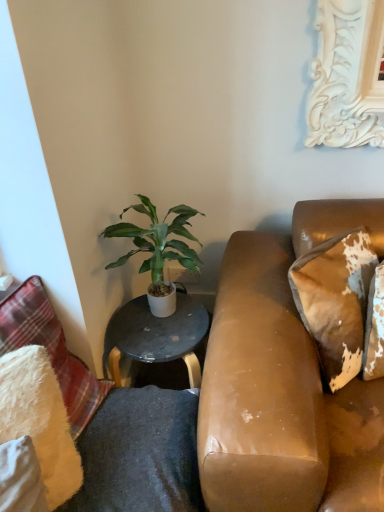
Question: Is green leafy plant at center far from white fluffy pillow at lower left, placed as the 2th pillow when sorted from left to right?

Choices:
 (A) no
 (B) yes

Answer: (A)

Question: Can you confirm if green leafy plant at center is wider than white fluffy pillow at lower left, placed as the 2th pillow when sorted from right to left?

Choices:
 (A) no
 (B) yes

Answer: (B)

Question: Could you tell me if green leafy plant at center is turned towards white fluffy pillow at lower left, placed as the 2th pillow when sorted from right to left?

Choices:
 (A) yes
 (B) no

Answer: (B)

Question: Can you confirm if green leafy plant at center is smaller than white fluffy pillow at lower left, placed as the 2th pillow when sorted from right to left?

Choices:
 (A) yes
 (B) no

Answer: (B)

Question: Is green leafy plant at center taller than white fluffy pillow at lower left, placed as the 2th pillow when sorted from right to left?

Choices:
 (A) yes
 (B) no

Answer: (A)

Question: Is white glossy table at center spatially inside green leafy plant at center, or outside of it?

Choices:
 (A) outside
 (B) inside

Answer: (A)

Question: Is white glossy table at center taller or shorter than green leafy plant at center?

Choices:
 (A) tall
 (B) short

Answer: (A)

Question: From a real-world perspective, relative to green leafy plant at center, is white glossy table at center vertically above or below?

Choices:
 (A) above
 (B) below

Answer: (B)

Question: In terms of width, does white glossy table at center look wider or thinner when compared to green leafy plant at center?

Choices:
 (A) wide
 (B) thin

Answer: (B)

Question: Considering the positions of leather-like brown pillow at right, the 1th pillow viewed from the right, and fluffy white pillow at left, the 1th pillow in the left-to-right sequence, in the image, is leather-like brown pillow at right, the 1th pillow viewed from the right, taller or shorter than fluffy white pillow at left, the 1th pillow in the left-to-right sequence,?

Choices:
 (A) short
 (B) tall

Answer: (A)

Question: Looking at the image, does leather-like brown pillow at right, placed as the third pillow when sorted from left to right, seem bigger or smaller compared to fluffy white pillow at left, the 1th pillow in the left-to-right sequence?

Choices:
 (A) small
 (B) big

Answer: (A)

Question: In terms of width, does leather-like brown pillow at right, the 1th pillow viewed from the right, look wider or thinner when compared to fluffy white pillow at left, the 1th pillow in the left-to-right sequence?

Choices:
 (A) wide
 (B) thin

Answer: (B)

Question: Which is correct: leather-like brown pillow at right, the 1th pillow viewed from the right, is inside fluffy white pillow at left, the 1th pillow in the left-to-right sequence, or outside of it?

Choices:
 (A) inside
 (B) outside

Answer: (B)

Question: In the image, is leather-like brown pillow at right, the 1th pillow viewed from the right, on the left side or the right side of white glossy table at center?

Choices:
 (A) right
 (B) left

Answer: (A)

Question: From a real-world perspective, is leather-like brown pillow at right, the 1th pillow viewed from the right, physically located above or below white glossy table at center?

Choices:
 (A) below
 (B) above

Answer: (B)